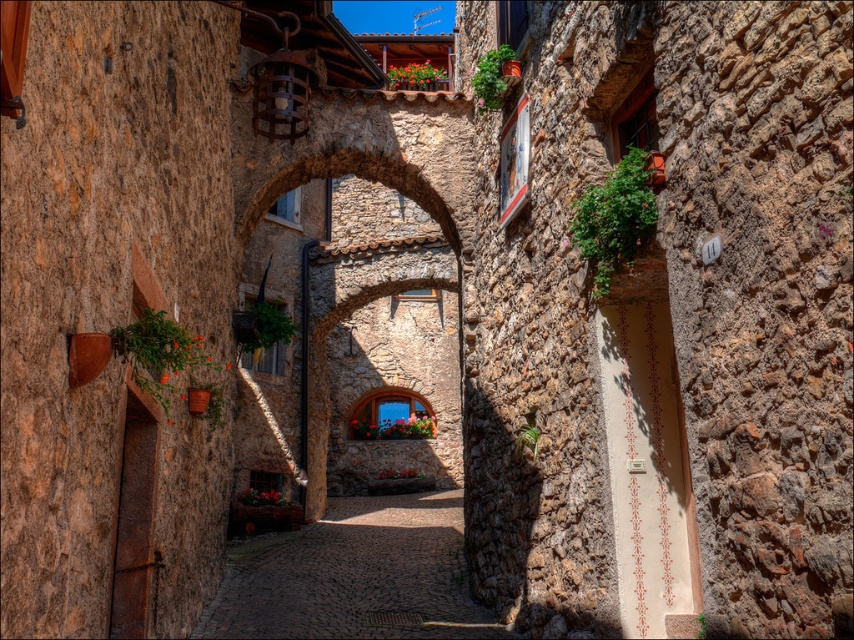
Question: Can you confirm if stone archway at center is thinner than cobblestone path at center?

Choices:
 (A) yes
 (B) no

Answer: (B)

Question: Can you confirm if stone archway at center is positioned below cobblestone path at center?

Choices:
 (A) no
 (B) yes

Answer: (A)

Question: Which object appears closest to the camera in this image?

Choices:
 (A) stone archway at center
 (B) cobblestone path at center

Answer: (B)

Question: Can you confirm if stone archway at center is bigger than cobblestone path at center?

Choices:
 (A) yes
 (B) no

Answer: (A)

Question: Which of the following is the farthest from the observer?

Choices:
 (A) stone archway at center
 (B) cobblestone path at center

Answer: (A)

Question: Which point is closer to the camera?

Choices:
 (A) (285, 612)
 (B) (323, 324)

Answer: (A)